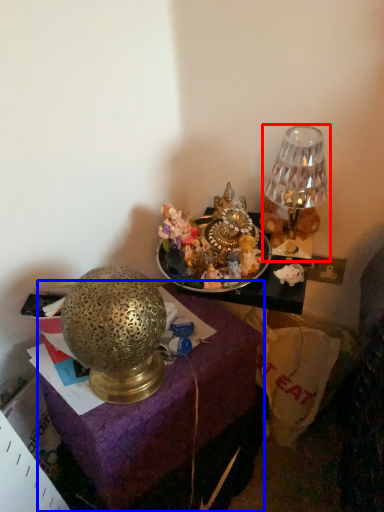
Question: Which point is closer to the camera, lamp (highlighted by a red box) or furniture (highlighted by a blue box)?

Choices:
 (A) lamp
 (B) furniture

Answer: (B)